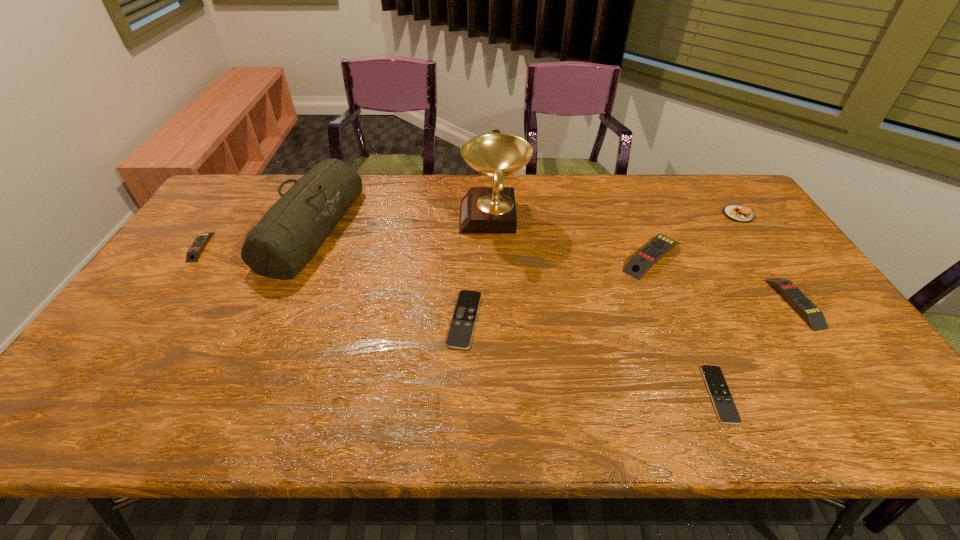
Identify the location of remote control located at the right edge. (814, 317).

Image resolution: width=960 pixels, height=540 pixels. In order to click on object at the far right corner in this screenshot , I will do `click(737, 213)`.

This screenshot has width=960, height=540. In order to click on vacant space at the far edge of the desktop in this screenshot , I will do (x=558, y=198).

In the image, there is a desktop. Where is `vacant space at the near edge`? The height and width of the screenshot is (540, 960). vacant space at the near edge is located at coordinates (425, 411).

Locate an element on the screen. This screenshot has height=540, width=960. vacant space at the left edge of the desktop is located at coordinates click(174, 269).

In the image, there is a desktop. What are the coordinates of `free region at the right edge` in the screenshot? It's located at (853, 390).

Locate an element on the screen. The image size is (960, 540). vacant region at the far left corner of the desktop is located at coordinates (237, 192).

I want to click on vacant space at the far right corner of the desktop, so click(x=714, y=174).

At what (x,y) coordinates should I click in order to perform the action: click on vacant area that lies between the tallest object and the patty. Please return your answer as a coordinate pair (x, y). This screenshot has height=540, width=960. Looking at the image, I should click on click(x=616, y=216).

Identify the location of blank region between the shortest object and the tallest object. (607, 306).